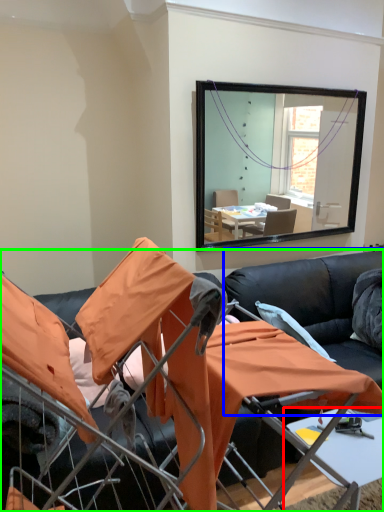
Question: Considering the real-world distances, which object is closest to table (highlighted by a red box)? couch (highlighted by a blue box) or studio couch (highlighted by a green box).

Choices:
 (A) couch
 (B) studio couch

Answer: (B)